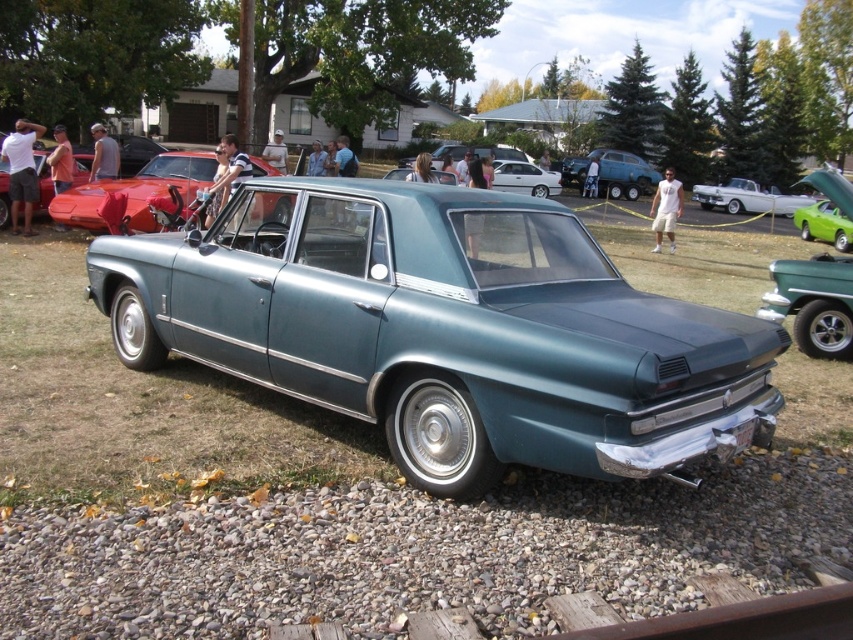
Is point (844, 264) behind point (643, 182)?

No, it is in front of (643, 182).

Is metallic green car at center above teal metallic sedan at center?

Incorrect, metallic green car at center is not positioned above teal metallic sedan at center.

The width and height of the screenshot is (853, 640). I want to click on metallic green car at center, so click(x=813, y=304).

Locate an element on the screen. The image size is (853, 640). metallic green car at center is located at coordinates (813, 304).

Is shiny red car at center positioned in front of metallic green car at center?

Yes, it is in front of metallic green car at center.

Consider the image. Can you confirm if shiny red car at center is taller than metallic green car at center?

Yes, shiny red car at center is taller than metallic green car at center.

Is point (85, 211) behind point (788, 260)?

Yes, it is behind point (788, 260).

Locate an element on the screen. The image size is (853, 640). shiny red car at center is located at coordinates (137, 192).

Is metallic teal sedan at center shorter than shiny red car at center?

Correct, metallic teal sedan at center is not as tall as shiny red car at center.

Is metallic teal sedan at center thinner than shiny red car at center?

Correct, metallic teal sedan at center's width is less than shiny red car at center's.

This screenshot has height=640, width=853. Find the location of `metallic teal sedan at center`. metallic teal sedan at center is located at coordinates (445, 330).